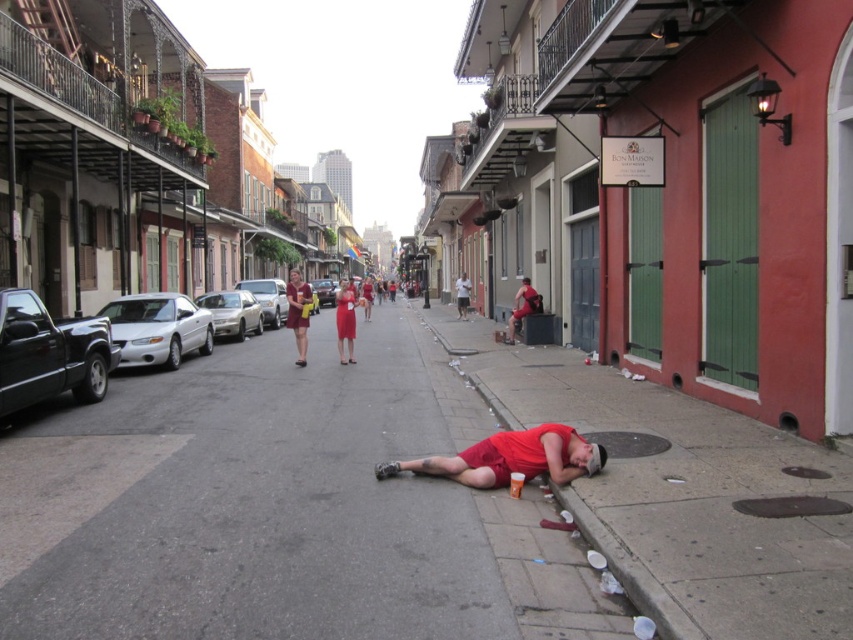
You are standing on the sidewalk in front of the BON MAISON building. You see an object at point [511,458]. What is the object?

The object at point [511,458] is matte red shorts at lower center.

Based on the photo, you are a photographer wanting to capture both the matte red shorts at lower center and the matte red dress at center in a single frame. Since the camera has a limited focus range, which object should you prioritize to ensure it is in focus, considering their sizes?

The matte red shorts at lower center has a lesser width compared to the matte red dress at center, so you should prioritize focusing on the matte red dress at center to ensure it is in focus as it is larger and might require more detailed focus.

You are a fashion designer who wants to showcase two outfits in a photo shoot. You have a matte red shorts at lower center and a matte red dress at center. The camera is positioned at the street level. Can you fit both outfits in the same frame without moving the camera? Explain your reasoning based on their distance apart.

The matte red shorts at lower center and matte red dress at center are 10.36 meters apart. Depending on the camera lens used, it may be challenging to capture both in the same frame without moving the camera. A wide angle lens could potentially include both, but the distance might require adjusting the composition or using a lens with a wider field of view to ensure both outfits are visible within the frame.